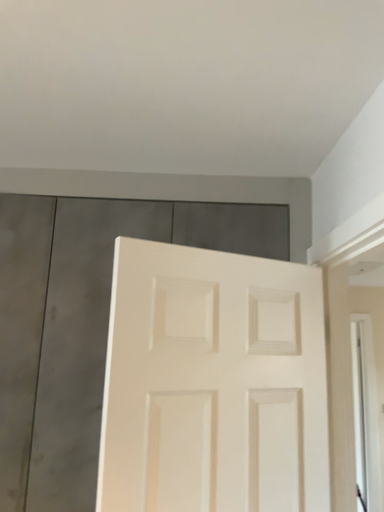
In order to click on white matte door at center in this screenshot , I will do `click(213, 384)`.

Image resolution: width=384 pixels, height=512 pixels. What do you see at coordinates (213, 384) in the screenshot?
I see `white matte door at center` at bounding box center [213, 384].

Find the location of a particular element. white matte door at center is located at coordinates (213, 384).